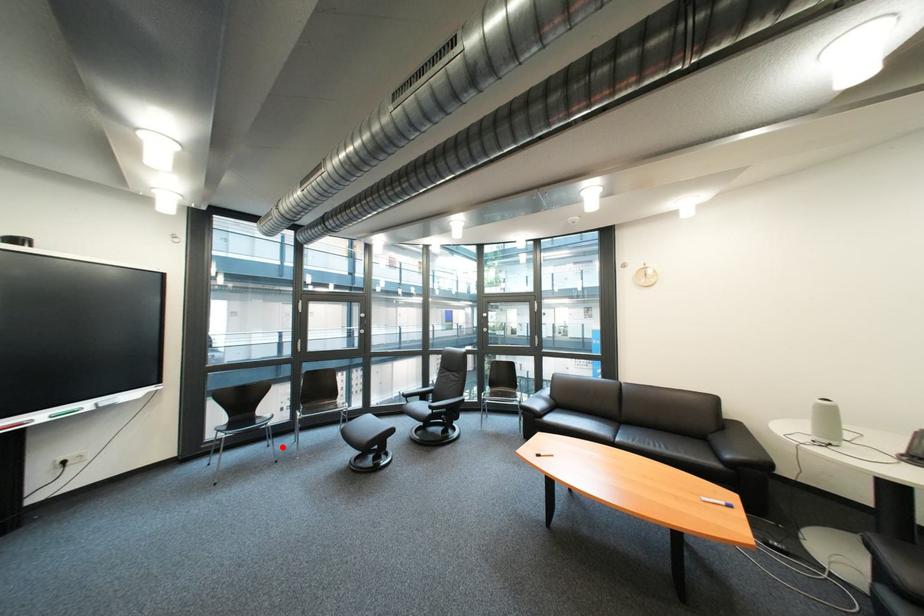
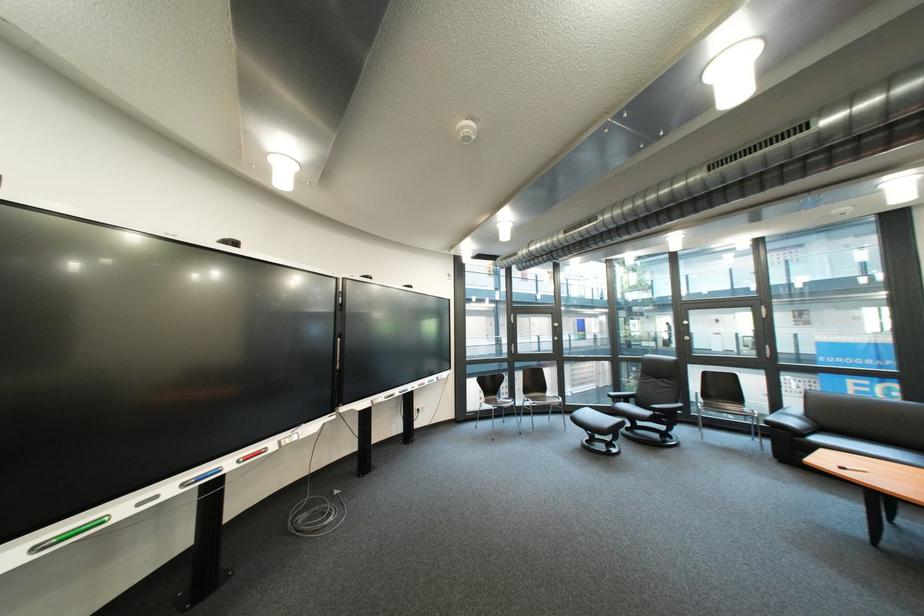
Question: I am providing you with two images of the same scene from different viewpoints. Given a red point in image1, look at the same physical point in image2. Is it:

Choices:
 (A) Closer to the viewpoint
 (B) Farther from the viewpoint

Answer: (B)